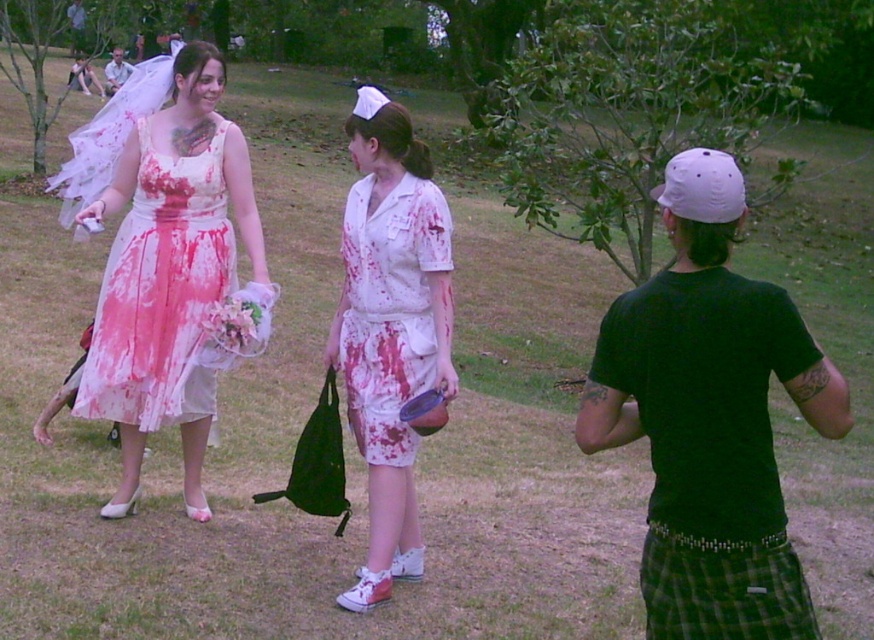
You are standing in the park and want to take a photo of the point at coordinates [383,200]. If you are 4.61 meters away from it, will you be able to capture it clearly in your camera?

The point at coordinates [383,200] is exactly 4.61 meters away from you, so yes, you can capture it clearly as you are at the correct distance.